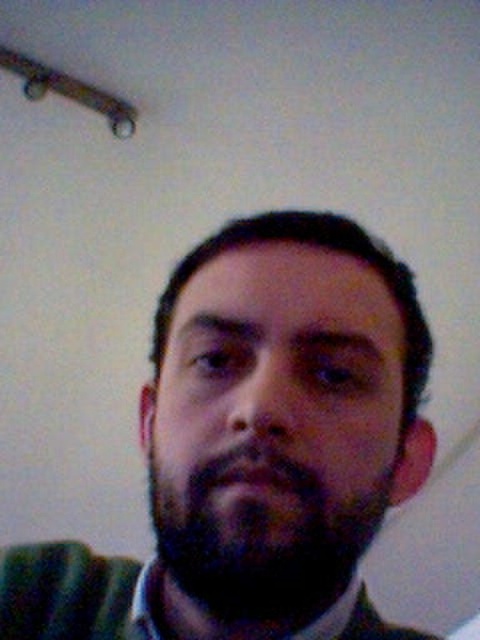
Can you confirm if dark brown hair at center is bigger than dark brown fuzzy beard at center?

Yes.

Who is more distant from viewer, (x=384, y=627) or (x=265, y=534)?

The point (x=384, y=627) is more distant.

The width and height of the screenshot is (480, 640). Describe the element at coordinates (256, 448) in the screenshot. I see `dark brown hair at center` at that location.

At what (x,y) coordinates should I click in order to perform the action: click on dark brown hair at center. Please return your answer as a coordinate pair (x, y). Looking at the image, I should click on (256, 448).